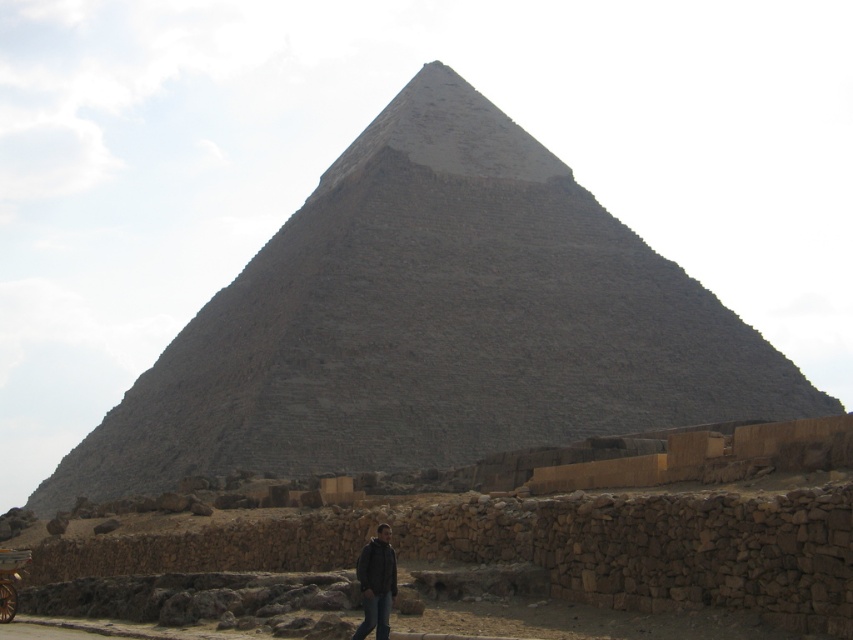
Who is positioned more to the left, gray stone pyramid at center or black leather jacket at lower center?

gray stone pyramid at center is more to the left.

Is gray stone pyramid at center to the left of black leather jacket at lower center from the viewer's perspective?

Correct, you'll find gray stone pyramid at center to the left of black leather jacket at lower center.

Is point (476, 268) closer to camera compared to point (378, 611)?

No, it is not.

You are a GUI agent. You are given a task and a screenshot of the screen. Output one action in this format:
    pyautogui.click(x=<x>, y=<y>)
    Task: Click on the gray stone pyramid at center
    The image size is (853, 640).
    Given the screenshot: What is the action you would take?
    pyautogui.click(x=433, y=323)